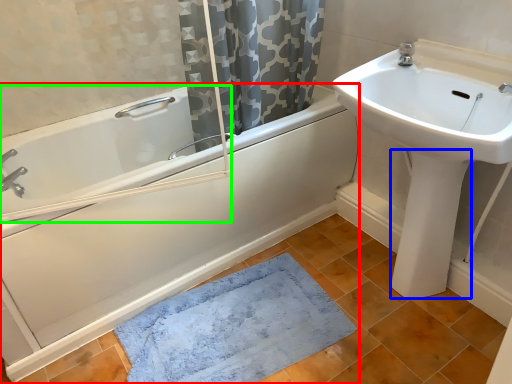
Question: Which object is the closest to the bathtub (highlighted by a red box)? Choose among these: bidet (highlighted by a blue box) or bath (highlighted by a green box).

Choices:
 (A) bidet
 (B) bath

Answer: (B)